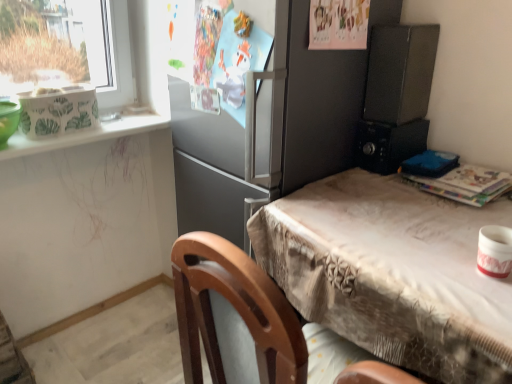
Question: Is white glossy window sill at upper left wider than satin gray refrigerator at center?

Choices:
 (A) no
 (B) yes

Answer: (A)

Question: Is white glossy window sill at upper left outside of satin gray refrigerator at center?

Choices:
 (A) yes
 (B) no

Answer: (A)

Question: Does white glossy window sill at upper left turn towards satin gray refrigerator at center?

Choices:
 (A) no
 (B) yes

Answer: (A)

Question: Considering the relative positions of white glossy window sill at upper left and satin gray refrigerator at center in the image provided, is white glossy window sill at upper left to the right of satin gray refrigerator at center from the viewer's perspective?

Choices:
 (A) no
 (B) yes

Answer: (A)

Question: Is white glossy window sill at upper left in front of satin gray refrigerator at center?

Choices:
 (A) no
 (B) yes

Answer: (A)

Question: From the image's perspective, is white glossy window sill at upper left beneath satin gray refrigerator at center?

Choices:
 (A) yes
 (B) no

Answer: (B)

Question: Considering the relative sizes of black plastic microwave at right, which appears as the 1th appliance when viewed from the back, and matte black microwave at upper right, positioned as the 3th appliance in bottom-to-top order, in the image provided, is black plastic microwave at right, which appears as the 1th appliance when viewed from the back, smaller than matte black microwave at upper right, positioned as the 3th appliance in bottom-to-top order,?

Choices:
 (A) yes
 (B) no

Answer: (A)

Question: Is black plastic microwave at right, which appears as the 1th appliance when viewed from the back, thinner than matte black microwave at upper right, placed as the second appliance when sorted from back to front?

Choices:
 (A) yes
 (B) no

Answer: (B)

Question: Is black plastic microwave at right, which is the second appliance in bottom-to-top order, placed right next to matte black microwave at upper right, positioned as the 3th appliance in bottom-to-top order?

Choices:
 (A) yes
 (B) no

Answer: (B)

Question: From the image's perspective, is black plastic microwave at right, which is the second appliance in bottom-to-top order, located beneath matte black microwave at upper right, positioned as the 3th appliance in bottom-to-top order?

Choices:
 (A) yes
 (B) no

Answer: (A)

Question: Would you say matte black microwave at upper right, positioned as the 3th appliance in bottom-to-top order, is part of black plastic microwave at right, which appears as the 1th appliance when viewed from the back,'s contents?

Choices:
 (A) yes
 (B) no

Answer: (B)

Question: Is black plastic microwave at right, which is the second appliance in bottom-to-top order, positioned with its back to matte black microwave at upper right, the first appliance when ordered from top to bottom?

Choices:
 (A) yes
 (B) no

Answer: (B)

Question: Is black plastic microwave at right, which is the second appliance in top-to-bottom order, facing away from satin gray refrigerator at center?

Choices:
 (A) no
 (B) yes

Answer: (A)